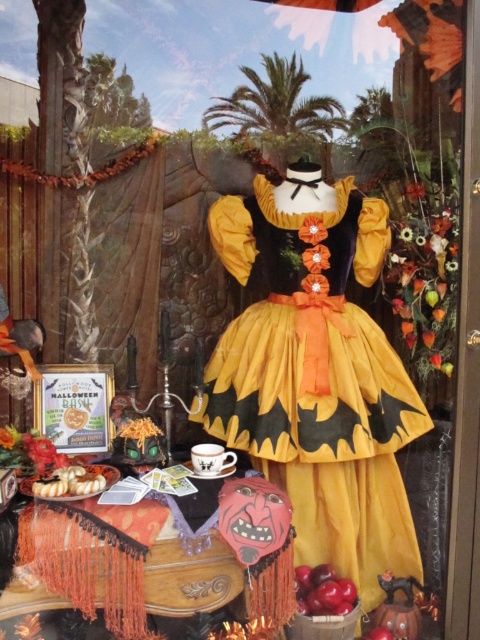
You are a party planner arranging decorations for the Halloween event. You have a matte yellow fabric dress at center and shiny red apples at lower center. Which object should you place on the table to ensure it stands out more as the centerpiece?

The matte yellow fabric dress at center is larger in size than the shiny red apples at lower center, so it should be placed as the centerpiece to stand out more.

You are a guest at the Halloween party and want to take a photo with the matte yellow fabric dress at center. However, there is a white fluffy pastry at lower left nearby. To avoid accidentally stepping on the pastry, which direction should you move relative to the dress?

The matte yellow fabric dress at center is to the right of the white fluffy pastry at lower left. To avoid stepping on the pastry, you should move to the left of the dress.